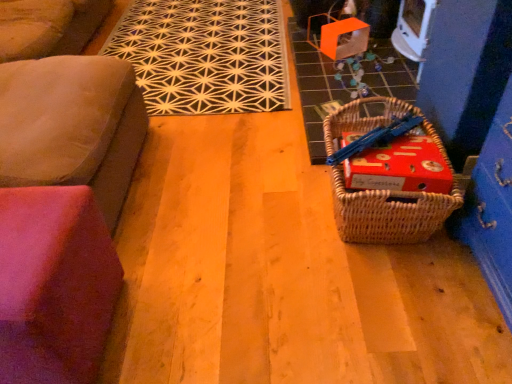
Question: From their relative heights in the image, would you say woven brown picnic basket at lower right is taller or shorter than black geometric rug at upper center?

Choices:
 (A) short
 (B) tall

Answer: (B)

Question: Considering the positions of woven brown picnic basket at lower right and black geometric rug at upper center in the image, is woven brown picnic basket at lower right bigger or smaller than black geometric rug at upper center?

Choices:
 (A) big
 (B) small

Answer: (B)

Question: Which is farther from the black geometric rug at upper center?

Choices:
 (A) woven brown picnic basket at lower right
 (B) red cardboard box at lower right
 (C) suede couch at left, which appears as the second furniture when ordered from the bottom
 (D) pink fabric cushion at lower left, which is the first furniture from bottom to top

Answer: (D)

Question: Considering the real-world distances, which object is farthest from the black geometric rug at upper center?

Choices:
 (A) red cardboard box at lower right
 (B) suede couch at left, acting as the 1th furniture starting from the top
 (C) pink fabric cushion at lower left, the second furniture from the top
 (D) woven brown picnic basket at lower right

Answer: (C)